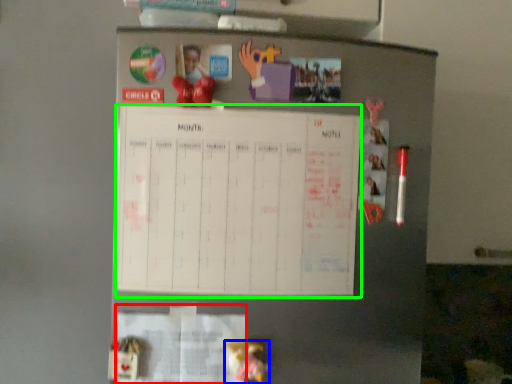
Question: Based on their relative distances, which object is nearer to paper (highlighted by a red box)? Choose from toy (highlighted by a blue box) and bulletin board (highlighted by a green box).

Choices:
 (A) toy
 (B) bulletin board

Answer: (A)